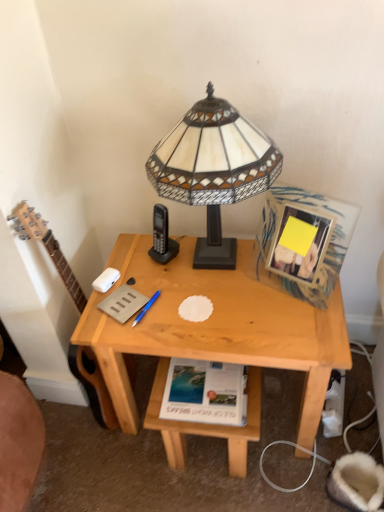
Image resolution: width=384 pixels, height=512 pixels. I want to click on vacant space to the right of natural wood table at lower center, so click(290, 430).